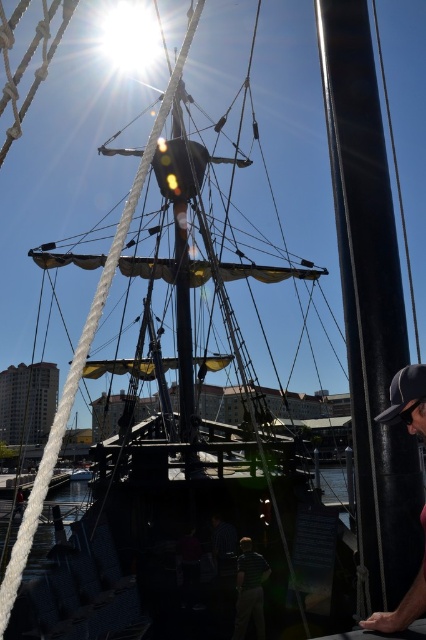
You are standing at the point marked as point [250,589] in the image. What object is directly in front of you?

The green striped shirt at center is directly in front of you at point [250,589].

You are standing at the center of the ship and looking towards the dark gray cap at lower right located at point (406, 400). Which direction should you turn to face the dark gray cap at lower right?

You should turn to your right to face the dark gray cap at lower right located at point (406, 400).